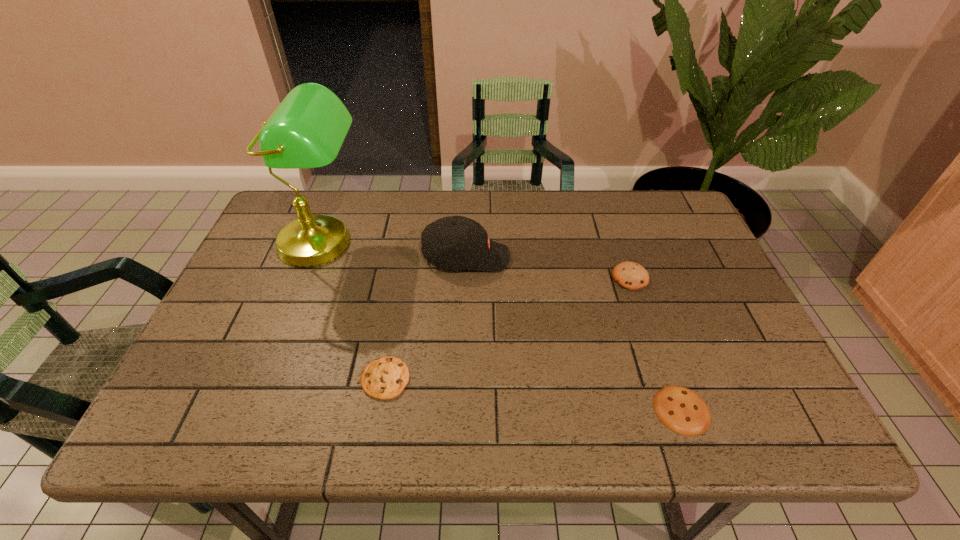
Locate an element on the screen. The image size is (960, 540). object that stands as the fourth closest to the farthest cookie is located at coordinates (306, 130).

Locate which cookie is the second closest to the leftmost cookie. Please provide its 2D coordinates. Your answer should be formatted as a tuple, i.e. [(x, y)], where the tuple contains the x and y coordinates of a point satisfying the conditions above.

[(629, 275)]

This screenshot has height=540, width=960. Find the location of `cookie that is the closest to the baseball cap`. cookie that is the closest to the baseball cap is located at coordinates (384, 378).

Where is `free spot that satisfies the following two spatial constraints: 1. with a logo on the front of the tallest cookie; 2. on the left side of the fourth shortest object`? free spot that satisfies the following two spatial constraints: 1. with a logo on the front of the tallest cookie; 2. on the left side of the fourth shortest object is located at coordinates (466, 278).

Where is `vacant area that satisfies the following two spatial constraints: 1. with a logo on the front of the baseball cap; 2. on the left side of the tallest cookie`? vacant area that satisfies the following two spatial constraints: 1. with a logo on the front of the baseball cap; 2. on the left side of the tallest cookie is located at coordinates (466, 278).

Identify the location of vacant space that satisfies the following two spatial constraints: 1. on the front side of the leftmost cookie; 2. on the right side of the shortest cookie. The image size is (960, 540). (380, 410).

At what (x,y) coordinates should I click in order to perform the action: click on free spot that satisfies the following two spatial constraints: 1. on the desk next to the farthest cookie; 2. on the right side of the lamp. Please return your answer as a coordinate pair (x, y). This screenshot has height=540, width=960. Looking at the image, I should click on (310, 278).

Image resolution: width=960 pixels, height=540 pixels. In order to click on vacant region that satisfies the following two spatial constraints: 1. with a logo on the front of the baseball cap; 2. on the back side of the shortest cookie in this screenshot , I will do `click(462, 410)`.

Locate an element on the screen. This screenshot has width=960, height=540. free space that satisfies the following two spatial constraints: 1. on the back side of the tallest cookie; 2. on the right side of the leftmost cookie is located at coordinates (403, 278).

You are a GUI agent. You are given a task and a screenshot of the screen. Output one action in this format:
    pyautogui.click(x=<x>, y=<y>)
    Task: Click on the free location that satisfies the following two spatial constraints: 1. on the desk next to the leftmost cookie; 2. on the right side of the leftmost object
    This screenshot has height=540, width=960.
    Given the screenshot: What is the action you would take?
    pyautogui.click(x=272, y=379)